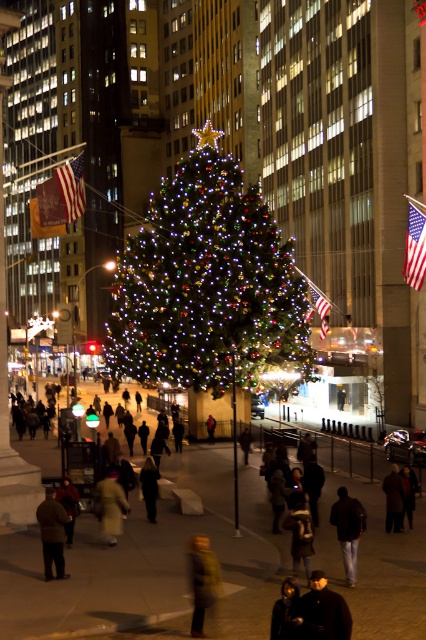
Does point (344, 515) lie in front of point (51, 560)?

No, it is behind (51, 560).

Can you confirm if dark brown leather jacket at lower right is bigger than dark brown coat at lower left?

Incorrect, dark brown leather jacket at lower right is not larger than dark brown coat at lower left.

Is point (354, 557) in front of point (45, 500)?

Yes, point (354, 557) is in front of point (45, 500).

Locate an element on the screen. dark brown leather jacket at lower right is located at coordinates (348, 529).

Is dark brown coat at lower left bigger than yellow wool coat at center?

Yes, dark brown coat at lower left is bigger than yellow wool coat at center.

Can you confirm if dark brown coat at lower left is shorter than yellow wool coat at center?

In fact, dark brown coat at lower left may be taller than yellow wool coat at center.

Does point (51, 568) come in front of point (112, 493)?

Yes, point (51, 568) is closer to viewer.

This screenshot has height=640, width=426. In order to click on dark brown coat at lower left in this screenshot , I will do `click(52, 532)`.

Who is lower down, green fuzzy coat at lower center or dark brown leather jacket at lower right?

dark brown leather jacket at lower right

Between green fuzzy coat at lower center and dark brown leather jacket at lower right, which one appears on the left side from the viewer's perspective?

green fuzzy coat at lower center is more to the left.

Locate an element on the screen. green fuzzy coat at lower center is located at coordinates (201, 579).